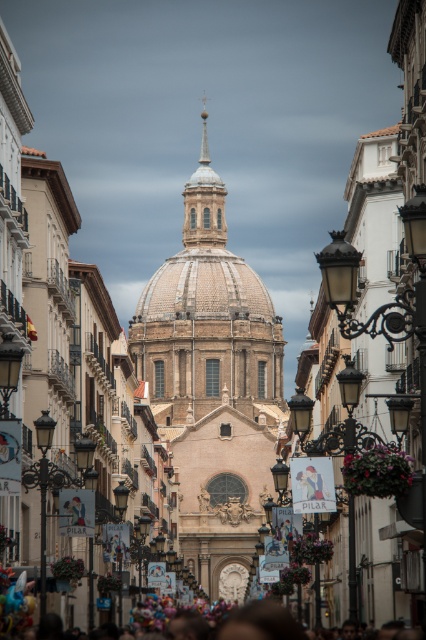
Is beige stone church at center in front of multicolored fabric crowd at lower center?

No, beige stone church at center is behind multicolored fabric crowd at lower center.

This screenshot has height=640, width=426. What do you see at coordinates (213, 385) in the screenshot?
I see `beige stone church at center` at bounding box center [213, 385].

Does point (187, 554) lie behind point (40, 628)?

Yes, it is behind point (40, 628).

Locate an element on the screen. beige stone church at center is located at coordinates (213, 385).